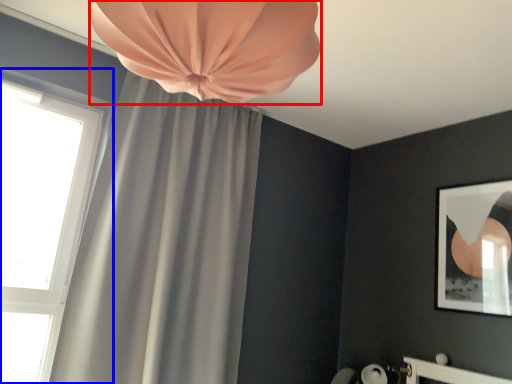
Question: Among these objects, which one is nearest to the camera, curtain (highlighted by a red box) or window (highlighted by a blue box)?

Choices:
 (A) curtain
 (B) window

Answer: (A)